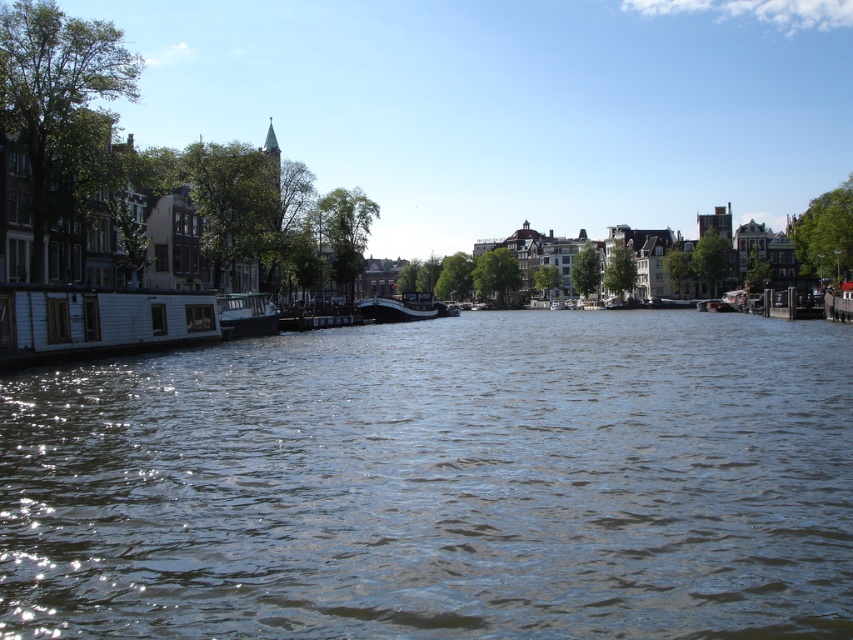
Based on the photo, between white glossy boat at left and white glossy boat at center, which one is positioned lower?

white glossy boat at left is lower down.

Is white glossy boat at left further to the viewer compared to white glossy boat at center?

No, white glossy boat at left is closer to the viewer.

What do you see at coordinates (245, 314) in the screenshot? I see `white glossy boat at left` at bounding box center [245, 314].

Locate an element on the screen. This screenshot has width=853, height=640. white glossy boat at left is located at coordinates (245, 314).

Is point (850, 449) closer to viewer compared to point (386, 308)?

Yes, it is in front of point (386, 308).

Is the position of brown water at center less distant than that of white glossy boat at center?

That is True.

The width and height of the screenshot is (853, 640). What do you see at coordinates (439, 483) in the screenshot?
I see `brown water at center` at bounding box center [439, 483].

At what (x,y) coordinates should I click in order to perform the action: click on brown water at center. Please return your answer as a coordinate pair (x, y). Looking at the image, I should click on (439, 483).

From the picture: Is brown water at center shorter than white glossy boat at left?

No.

Locate an element on the screen. This screenshot has width=853, height=640. brown water at center is located at coordinates (439, 483).

Does point (381, 576) lie in front of point (245, 324)?

Yes.

The image size is (853, 640). In order to click on brown water at center in this screenshot , I will do `click(439, 483)`.